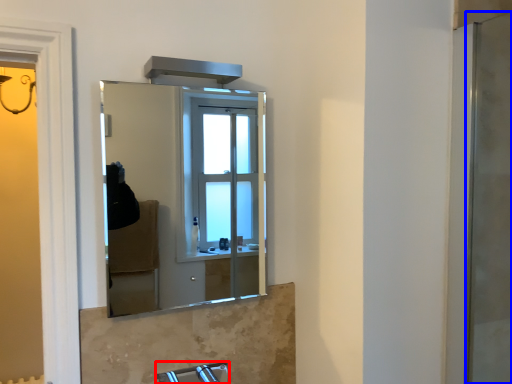
Question: Which object appears farthest to the camera in this image, faucet (highlighted by a red box) or screen door (highlighted by a blue box)?

Choices:
 (A) faucet
 (B) screen door

Answer: (B)